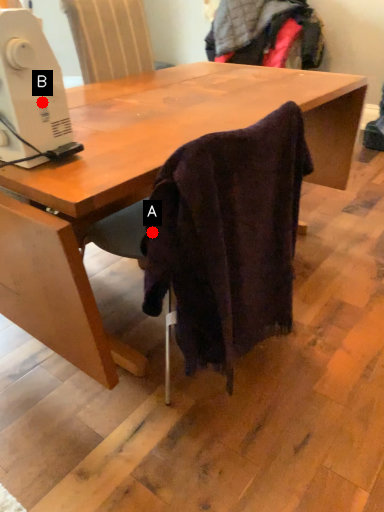
Question: Two points are circled on the image, labeled by A and B beside each circle. Among these points, which one is nearest to the camera?

Choices:
 (A) A is closer
 (B) B is closer

Answer: (B)